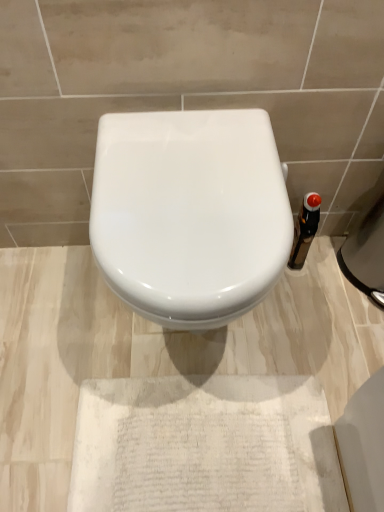
I want to click on free space in front of black glass bottle at right, so (302, 309).